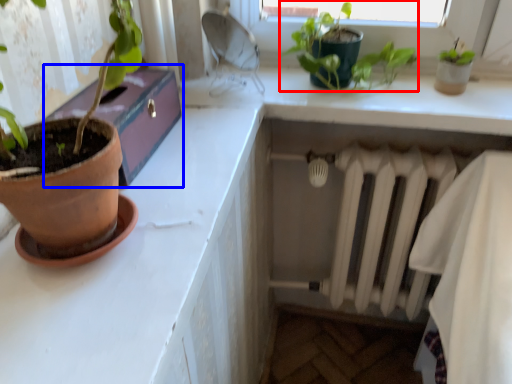
Question: Which of the following is the farthest to the observer, houseplant (highlighted by a red box) or window box (highlighted by a blue box)?

Choices:
 (A) houseplant
 (B) window box

Answer: (A)